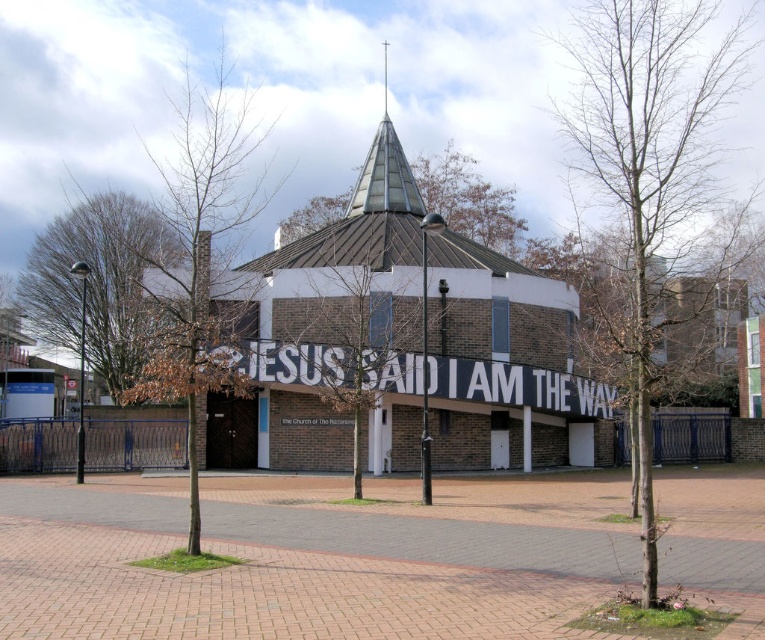
Question: Does brick textured church at center have a lesser width compared to shiny metallic spire at center top?

Choices:
 (A) yes
 (B) no

Answer: (B)

Question: In this image, where is brick textured church at center located relative to shiny metallic spire at center top?

Choices:
 (A) right
 (B) left

Answer: (A)

Question: Is brick textured church at center positioned before shiny metallic spire at center top?

Choices:
 (A) yes
 (B) no

Answer: (A)